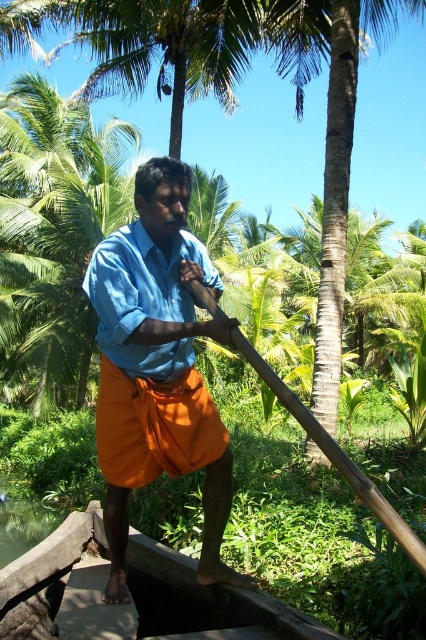
Does blue cotton shirt at center have a greater height compared to smooth brown trunk of palm tree at center?

No.

Is point (138, 221) behind point (307, 67)?

No, (138, 221) is in front of (307, 67).

Between point (132, 451) and point (339, 68), which one is positioned in front?

Point (132, 451) is more forward.

Where is `blue cotton shirt at center`? The width and height of the screenshot is (426, 640). blue cotton shirt at center is located at coordinates (157, 368).

What do you see at coordinates (330, 141) in the screenshot?
I see `smooth brown trunk of palm tree at center` at bounding box center [330, 141].

Which is more to the left, smooth brown trunk of palm tree at center or brown wooden paddle at center?

From the viewer's perspective, brown wooden paddle at center appears more on the left side.

The image size is (426, 640). What do you see at coordinates (330, 141) in the screenshot?
I see `smooth brown trunk of palm tree at center` at bounding box center [330, 141].

Where is `smooth brown trunk of palm tree at center`? The image size is (426, 640). smooth brown trunk of palm tree at center is located at coordinates (330, 141).

Which of these two, blue cotton shirt at center or brown wooden paddle at center, stands shorter?

brown wooden paddle at center is shorter.

Can you confirm if blue cotton shirt at center is smaller than brown wooden paddle at center?

Actually, blue cotton shirt at center might be larger than brown wooden paddle at center.

Locate an element on the screen. blue cotton shirt at center is located at coordinates (157, 368).

At what (x,y) coordinates should I click in order to perform the action: click on blue cotton shirt at center. Please return your answer as a coordinate pair (x, y). This screenshot has height=640, width=426. Looking at the image, I should click on (157, 368).